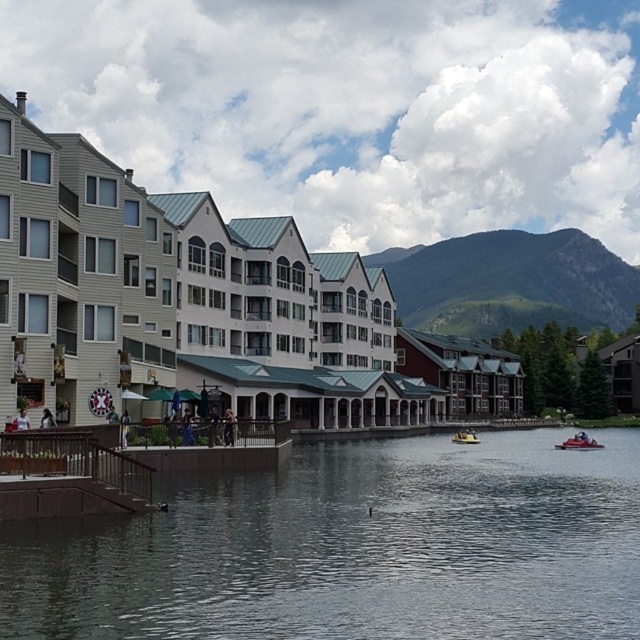
Question: Which of the following is the farthest from the observer?

Choices:
 (A) (3, 186)
 (B) (97, 452)

Answer: (A)

Question: Is brown wooden dock at lower left below yellow plastic boat at lower center?

Choices:
 (A) no
 (B) yes

Answer: (A)

Question: Estimate the real-world distances between objects in this image. Which object is closer to the green grassy mountain at upper right?

Choices:
 (A) transparent water at center
 (B) beige siding building at center

Answer: (B)

Question: Which point is closer to the camera?

Choices:
 (A) (468, 438)
 (B) (10, 440)

Answer: (B)

Question: Does transparent water at center come behind green grassy mountain at upper right?

Choices:
 (A) yes
 (B) no

Answer: (B)

Question: Can you confirm if transparent water at center is smaller than beige siding building at center?

Choices:
 (A) yes
 (B) no

Answer: (A)